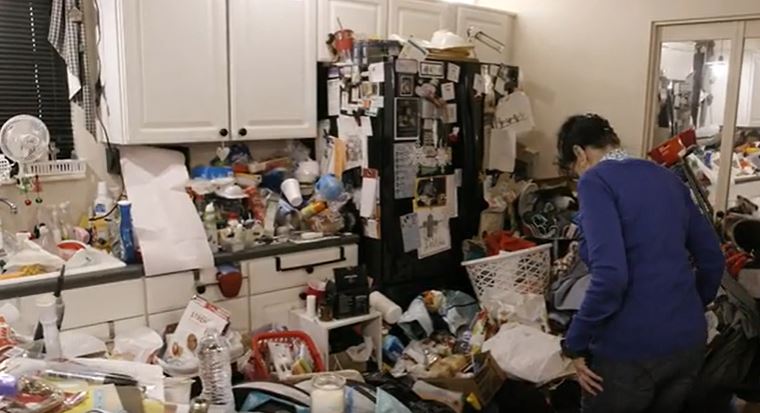
Find the location of a particular element. The image size is (760, 413). sink is located at coordinates (42, 277).